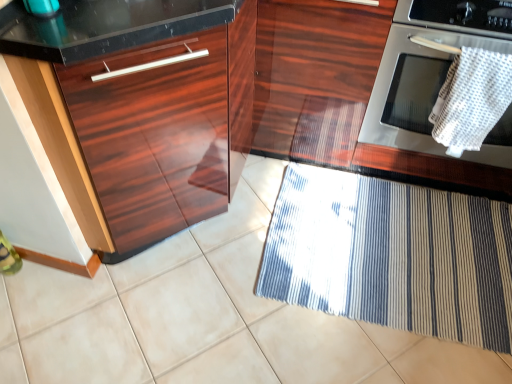
This screenshot has width=512, height=384. What do you see at coordinates (426, 65) in the screenshot?
I see `stainless steel oven at right` at bounding box center [426, 65].

Describe the element at coordinates (42, 7) in the screenshot. I see `brushed metal kettle at upper left` at that location.

You are a GUI agent. You are given a task and a screenshot of the screen. Output one action in this format:
    pyautogui.click(x=<x>, y=<y>)
    Task: Click on the glossy wood drawer at left
    
    Given the screenshot: What is the action you would take?
    pyautogui.click(x=154, y=139)

Identify the location of glossy wood cabinet at center, acting as the first cabinetry starting from the right. (315, 76).

What do you see at coordinates (250, 117) in the screenshot?
I see `glossy wood cabinet at center, marked as the first cabinetry in a left-to-right arrangement` at bounding box center [250, 117].

At what (x,y) coordinates should I click in order to perform the action: click on white woven towel at upper right. Please return your answer as a coordinate pair (x, y). This screenshot has height=384, width=512. Looking at the image, I should click on (x=471, y=99).

Identify the location of blue striped mat at lower right. (392, 256).

In terms of width, does glossy wood cabinet at center, marked as the first cabinetry in a left-to-right arrangement, look wider or thinner when compared to blue striped mat at lower right?

Clearly, glossy wood cabinet at center, marked as the first cabinetry in a left-to-right arrangement, has more width compared to blue striped mat at lower right.

Who is taller, glossy wood cabinet at center, placed as the 2th cabinetry when sorted from right to left, or blue striped mat at lower right?

Standing taller between the two is glossy wood cabinet at center, placed as the 2th cabinetry when sorted from right to left.

Is point (374, 14) closer to viewer compared to point (384, 220)?

Yes.

Can you tell me how much glossy wood cabinet at center, marked as the first cabinetry in a left-to-right arrangement, and blue striped mat at lower right differ in facing direction?

The angular difference between glossy wood cabinet at center, marked as the first cabinetry in a left-to-right arrangement, and blue striped mat at lower right is 0.818 degrees.

Looking at this image, considering the sizes of brushed metal kettle at upper left and glossy wood cabinet at center, acting as the first cabinetry starting from the right, in the image, is brushed metal kettle at upper left wider or thinner than glossy wood cabinet at center, acting as the first cabinetry starting from the right,?

Considering their sizes, brushed metal kettle at upper left looks slimmer than glossy wood cabinet at center, acting as the first cabinetry starting from the right.

In the scene shown: Is glossy wood cabinet at center, acting as the first cabinetry starting from the right, inside brushed metal kettle at upper left?

No, glossy wood cabinet at center, acting as the first cabinetry starting from the right, is not inside brushed metal kettle at upper left.

Is brushed metal kettle at upper left looking in the opposite direction of glossy wood cabinet at center, placed as the 2th cabinetry when sorted from left to right?

brushed metal kettle at upper left is not turned away from glossy wood cabinet at center, placed as the 2th cabinetry when sorted from left to right.

Based on the photo, considering the positions of objects stainless steel oven at right and glossy wood cabinet at center, placed as the 2th cabinetry when sorted from right to left, in the image provided, who is behind, stainless steel oven at right or glossy wood cabinet at center, placed as the 2th cabinetry when sorted from right to left,?

stainless steel oven at right is further from the camera.

In terms of size, does stainless steel oven at right appear bigger or smaller than glossy wood cabinet at center, placed as the 2th cabinetry when sorted from right to left?

stainless steel oven at right is smaller than glossy wood cabinet at center, placed as the 2th cabinetry when sorted from right to left.

From the picture: From a real-world perspective, which is physically above, stainless steel oven at right or glossy wood cabinet at center, placed as the 2th cabinetry when sorted from right to left?

glossy wood cabinet at center, placed as the 2th cabinetry when sorted from right to left, from a real-world perspective.

Which of these two, stainless steel oven at right or glossy wood cabinet at center, marked as the first cabinetry in a left-to-right arrangement, is thinner?

stainless steel oven at right is thinner.

Does glossy wood drawer at left appear on the left side of white woven towel at upper right?

Indeed, glossy wood drawer at left is positioned on the left side of white woven towel at upper right.

Can you tell me how much glossy wood drawer at left and white woven towel at upper right differ in facing direction?

They differ by 87.2 degrees in their facing directions.

Is point (132, 95) closer to viewer compared to point (451, 154)?

Yes.

Is white woven towel at upper right inside the boundaries of glossy wood drawer at left, or outside?

white woven towel at upper right cannot be found inside glossy wood drawer at left.

Does white woven towel at upper right appear on the left side of glossy wood drawer at left?

Incorrect, white woven towel at upper right is not on the left side of glossy wood drawer at left.

The height and width of the screenshot is (384, 512). Find the location of `drawer that is under the white woven towel at upper right (from a real-world perspective)`. drawer that is under the white woven towel at upper right (from a real-world perspective) is located at coordinates (154, 139).

Considering the positions of objects white woven towel at upper right and glossy wood drawer at left in the image provided, who is behind, white woven towel at upper right or glossy wood drawer at left?

white woven towel at upper right is more distant.

Considering the relative sizes of brushed metal kettle at upper left and white woven towel at upper right in the image provided, is brushed metal kettle at upper left shorter than white woven towel at upper right?

Yes.

Between brushed metal kettle at upper left and white woven towel at upper right, which one has larger width?

white woven towel at upper right.

Is point (40, 15) positioned in front of point (482, 134)?

Yes, it is in front of point (482, 134).

How distant is brushed metal kettle at upper left from white woven towel at upper right?

brushed metal kettle at upper left is 1.18 meters from white woven towel at upper right.

Is glossy wood drawer at left aimed at glossy wood cabinet at center, placed as the 2th cabinetry when sorted from left to right?

No.

Is glossy wood cabinet at center, acting as the first cabinetry starting from the right, located within glossy wood drawer at left?

That's incorrect, glossy wood cabinet at center, acting as the first cabinetry starting from the right, is not inside glossy wood drawer at left.

Is glossy wood drawer at left in front of glossy wood cabinet at center, placed as the 2th cabinetry when sorted from left to right?

Yes, it is in front of glossy wood cabinet at center, placed as the 2th cabinetry when sorted from left to right.

Is point (184, 184) farther from camera compared to point (344, 161)?

No, (184, 184) is closer to viewer.

Image resolution: width=512 pixels, height=384 pixels. Find the location of `cabinetry that is the 2nd one above the blue striped mat at lower right (from a real-world perspective)`. cabinetry that is the 2nd one above the blue striped mat at lower right (from a real-world perspective) is located at coordinates (250, 117).

You are a GUI agent. You are given a task and a screenshot of the screen. Output one action in this format:
    pyautogui.click(x=<x>, y=<y>)
    Task: Click on the cabinetry that is the 2nd object to the right of the brushed metal kettle at upper left, starting at the anchor
    Image resolution: width=512 pixels, height=384 pixels.
    Given the screenshot: What is the action you would take?
    pyautogui.click(x=315, y=76)

Considering their positions, is stainless steel oven at right positioned further to blue striped mat at lower right than glossy wood cabinet at center, acting as the first cabinetry starting from the right?

glossy wood cabinet at center, acting as the first cabinetry starting from the right, is further to blue striped mat at lower right.

Looking at the image, which one is located closer to blue striped mat at lower right, white woven towel at upper right or glossy wood cabinet at center, placed as the 2th cabinetry when sorted from left to right?

glossy wood cabinet at center, placed as the 2th cabinetry when sorted from left to right, is positioned closer to the anchor blue striped mat at lower right.

Based on their spatial positions, is blue striped mat at lower right or stainless steel oven at right closer to white woven towel at upper right?

stainless steel oven at right is positioned closer to the anchor white woven towel at upper right.

From the image, which object appears to be farther from glossy wood drawer at left, white woven towel at upper right or glossy wood cabinet at center, marked as the first cabinetry in a left-to-right arrangement?

Among the two, white woven towel at upper right is located further to glossy wood drawer at left.

Considering their positions, is glossy wood drawer at left positioned further to blue striped mat at lower right than brushed metal kettle at upper left?

brushed metal kettle at upper left is further to blue striped mat at lower right.

Which object lies further to the anchor point white woven towel at upper right, brushed metal kettle at upper left or glossy wood drawer at left?

brushed metal kettle at upper left lies further to white woven towel at upper right than the other object.

Looking at the image, which one is located further to glossy wood cabinet at center, acting as the first cabinetry starting from the right, white woven towel at upper right or brushed metal kettle at upper left?

brushed metal kettle at upper left.

Considering their positions, is stainless steel oven at right positioned closer to blue striped mat at lower right than glossy wood cabinet at center, marked as the first cabinetry in a left-to-right arrangement?

The object closer to blue striped mat at lower right is glossy wood cabinet at center, marked as the first cabinetry in a left-to-right arrangement.

Locate an element on the screen. Image resolution: width=512 pixels, height=384 pixels. cabinetry between glossy wood cabinet at center, placed as the 2th cabinetry when sorted from right to left, and white woven towel at upper right from left to right is located at coordinates (315, 76).

I want to click on drawer between glossy wood cabinet at center, marked as the first cabinetry in a left-to-right arrangement, and glossy wood cabinet at center, placed as the 2th cabinetry when sorted from left to right, from front to back, so click(154, 139).

You are a GUI agent. You are given a task and a screenshot of the screen. Output one action in this format:
    pyautogui.click(x=<x>, y=<y>)
    Task: Click on the doormat between glossy wood drawer at left and stainless steel oven at right from left to right
    
    Given the screenshot: What is the action you would take?
    pyautogui.click(x=392, y=256)

This screenshot has height=384, width=512. Find the location of `doormat located between brushed metal kettle at upper left and stainless steel oven at right in the left-right direction`. doormat located between brushed metal kettle at upper left and stainless steel oven at right in the left-right direction is located at coordinates (392, 256).